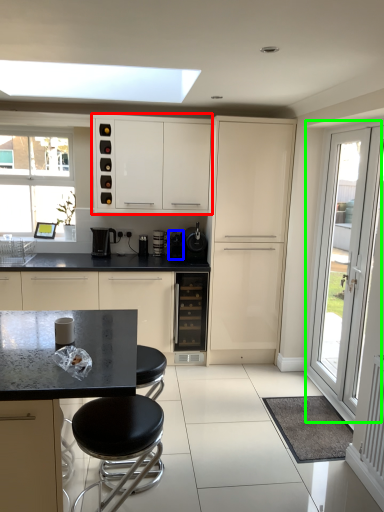
Question: Which object is positioned closest to cabinetry (highlighted by a red box)? Select from coffee machine (highlighted by a blue box) and door (highlighted by a green box).

Choices:
 (A) coffee machine
 (B) door

Answer: (A)